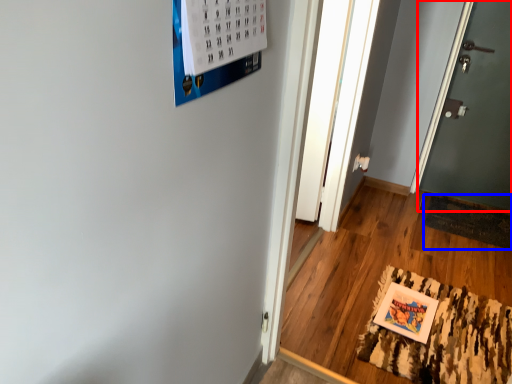
Question: Which object appears farthest to the camera in this image, door (highlighted by a red box) or doormat (highlighted by a blue box)?

Choices:
 (A) door
 (B) doormat

Answer: (B)